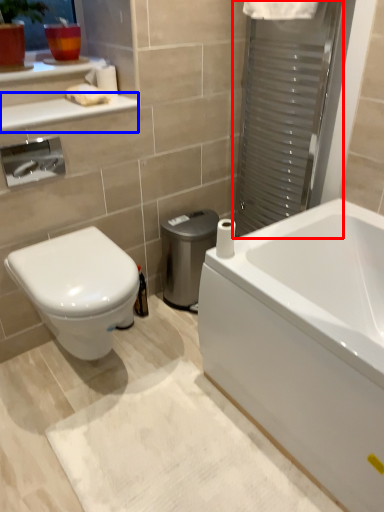
Question: Which object appears closest to the camera in this image, screen door (highlighted by a red box) or balustrade (highlighted by a blue box)?

Choices:
 (A) screen door
 (B) balustrade

Answer: (B)